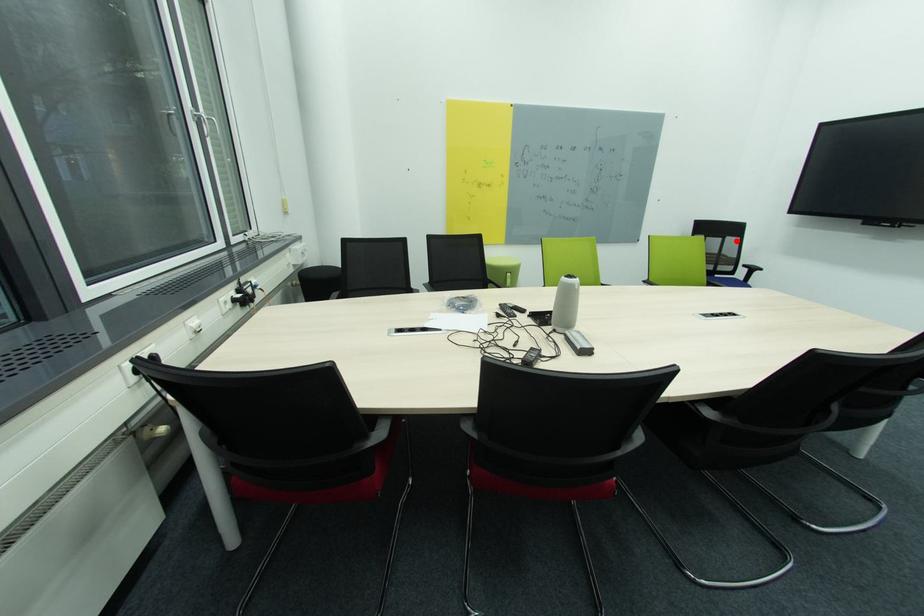
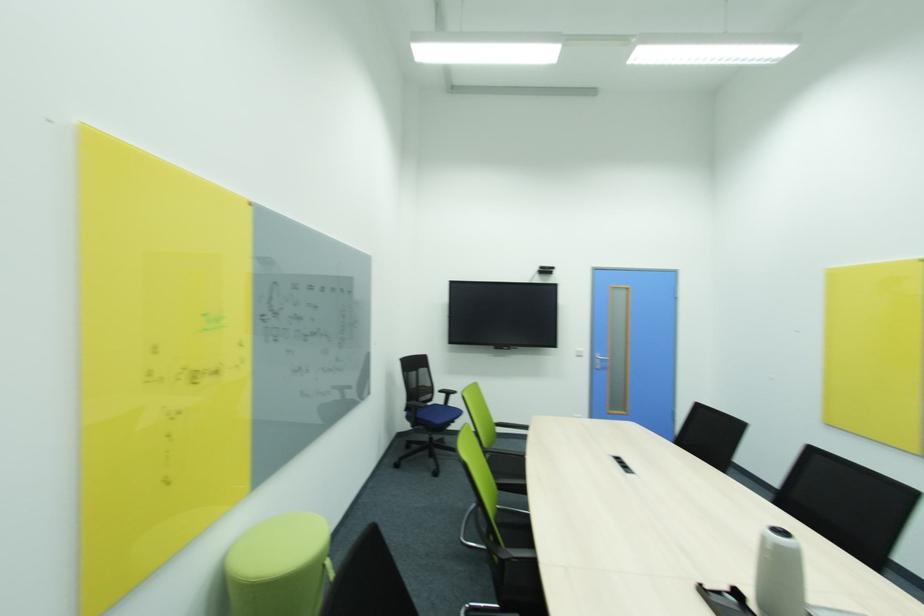
Where in the second image is the point corresponding to the highlighted location from the first image?

(428, 371)